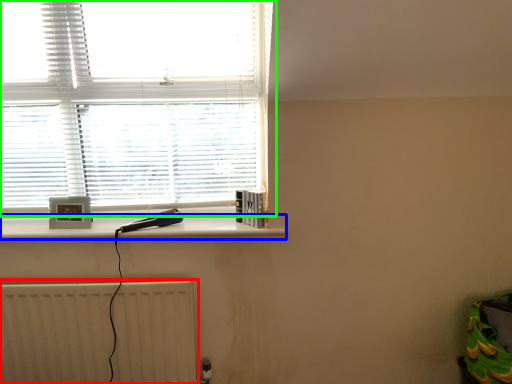
Question: Which is nearer to the radiator (highlighted by a red box)? ledge (highlighted by a blue box) or window (highlighted by a green box).

Choices:
 (A) ledge
 (B) window

Answer: (A)